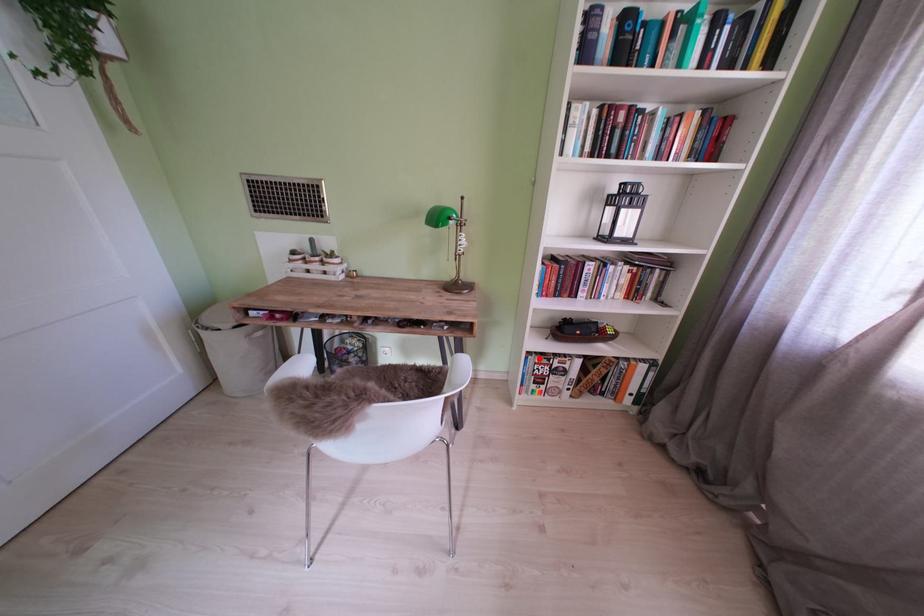
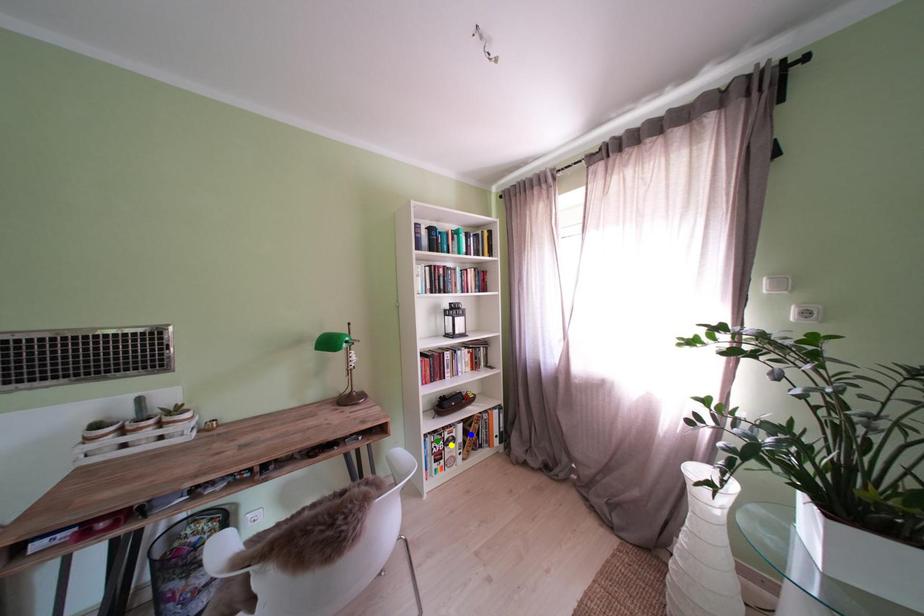
Question: I am providing you with two images of the same scene from different viewpoints. A red point is marked on the first image. You are given multiple points on the second image. In image 2, which mark is for the same physical point as the one in image 1?

Choices:
 (A) green point
 (B) blue point
 (C) yellow point

Answer: (A)